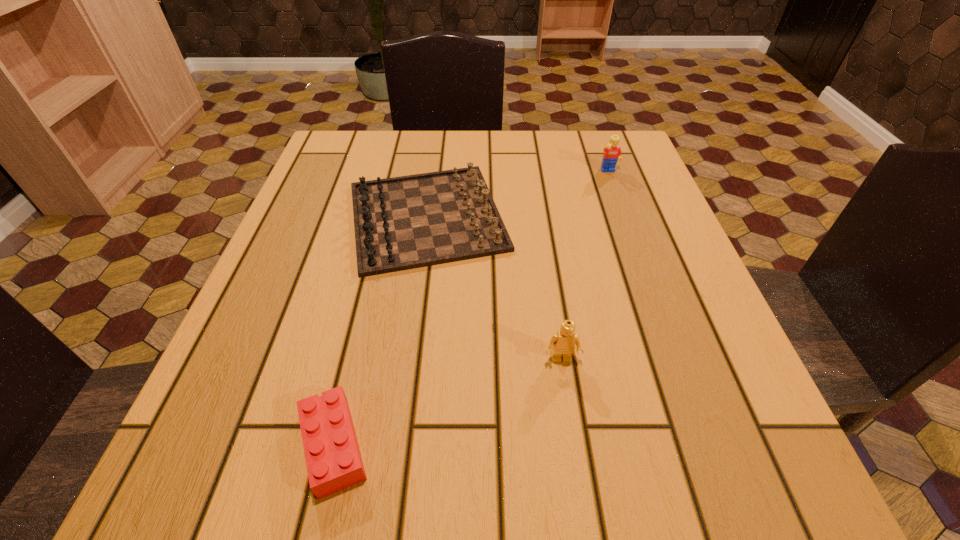
This screenshot has height=540, width=960. Find the location of `vacant region located on the right of the shortest Lego`. vacant region located on the right of the shortest Lego is located at coordinates click(x=472, y=446).

Find the location of a particular element. The image size is (960, 540). Lego at the far edge is located at coordinates (612, 152).

At what (x,y) coordinates should I click in order to perform the action: click on chessboard that is at the far edge. Please return your answer as a coordinate pair (x, y). This screenshot has width=960, height=540. Looking at the image, I should click on (407, 222).

Locate an element on the screen. The height and width of the screenshot is (540, 960). object that is at the near edge is located at coordinates (333, 459).

Locate an element on the screen. chessboard present at the left edge is located at coordinates (407, 222).

The width and height of the screenshot is (960, 540). I want to click on Lego situated at the left edge, so click(333, 459).

You are a GUI agent. You are given a task and a screenshot of the screen. Output one action in this format:
    pyautogui.click(x=<x>, y=<y>)
    Task: Click on the object that is at the right edge
    
    Given the screenshot: What is the action you would take?
    pyautogui.click(x=612, y=152)

Where is `object present at the far left corner`? object present at the far left corner is located at coordinates (407, 222).

You are a GUI agent. You are given a task and a screenshot of the screen. Output one action in this format:
    pyautogui.click(x=<x>, y=<y>)
    Task: Click on the object that is positioned at the near left corner
    
    Given the screenshot: What is the action you would take?
    pyautogui.click(x=333, y=459)

Find the location of `object that is at the far right corner`. object that is at the far right corner is located at coordinates (612, 152).